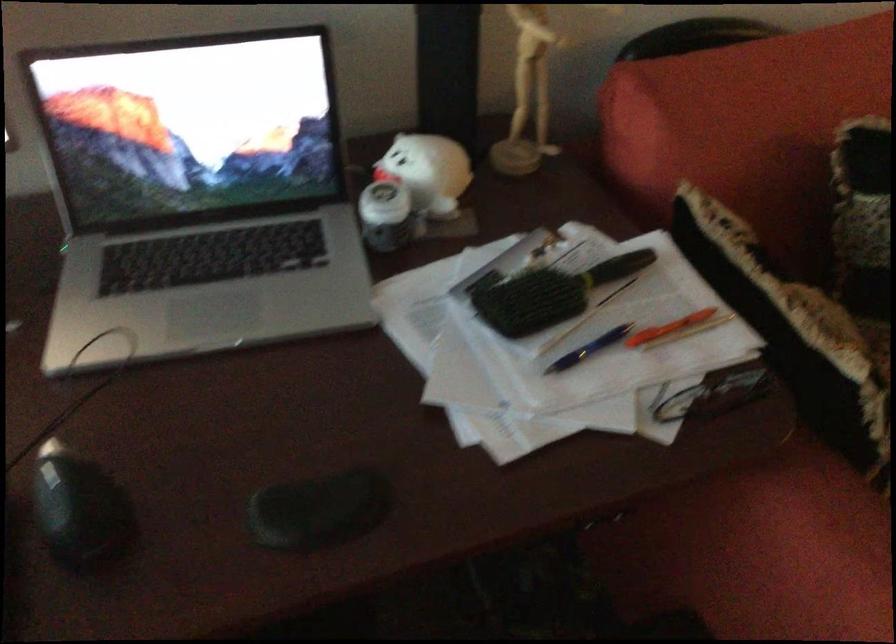
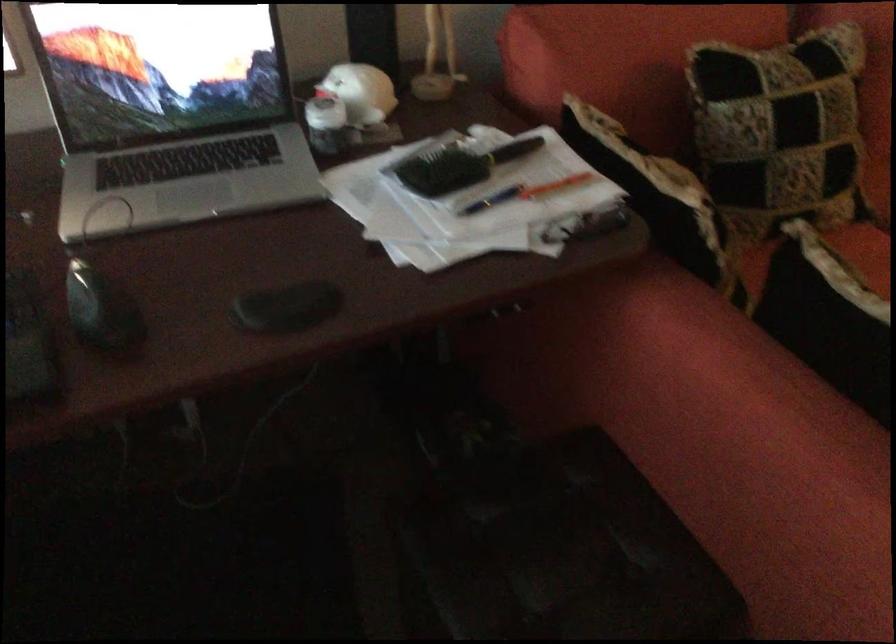
Question: The images are taken continuously from a first-person perspective. In which direction is your viewpoint rotating?

Choices:
 (A) Left
 (B) Right
 (C) Up
 (D) Down

Answer: (B)